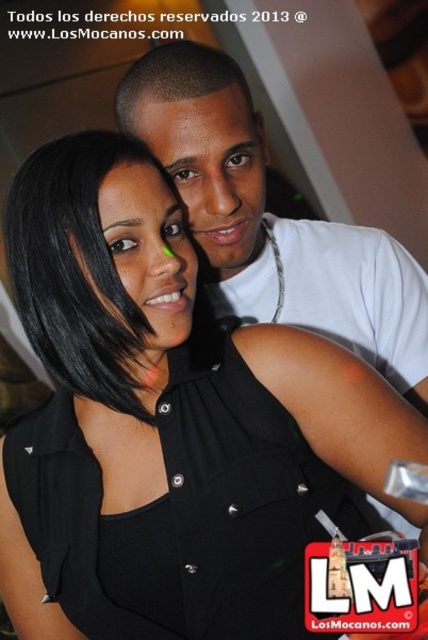
Question: Does black matte dress at center appear on the right side of white matte t-shirt at upper center?

Choices:
 (A) no
 (B) yes

Answer: (A)

Question: Considering the relative positions of black matte dress at center and white matte t-shirt at upper center in the image provided, where is black matte dress at center located with respect to white matte t-shirt at upper center?

Choices:
 (A) left
 (B) right

Answer: (A)

Question: Which object is closer to the camera taking this photo?

Choices:
 (A) white matte t-shirt at upper center
 (B) black matte dress at center

Answer: (B)

Question: Is black matte dress at center closer to camera compared to white matte t-shirt at upper center?

Choices:
 (A) yes
 (B) no

Answer: (A)